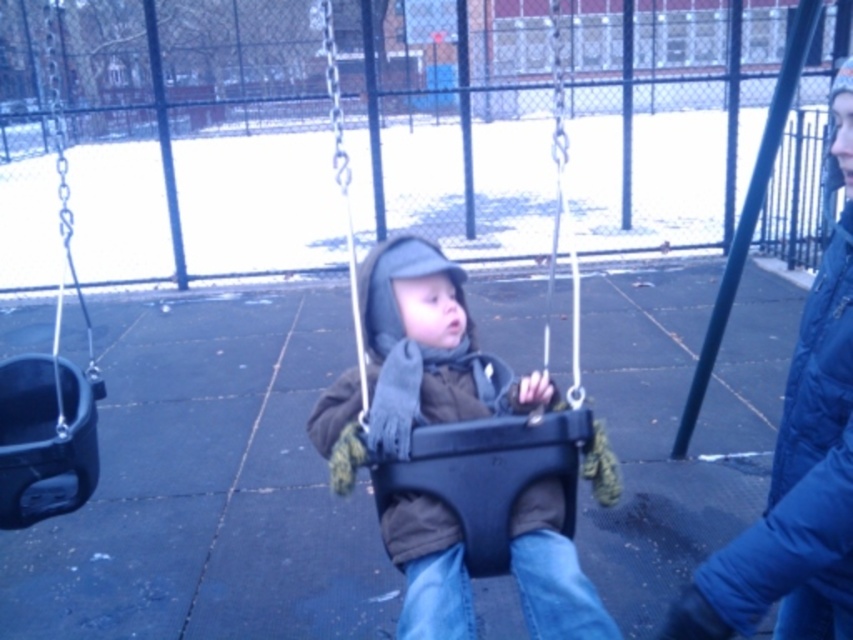
You are a parent trying to choose between two jackets for your child at the playground. You see the brown matte jacket at center and the blue fleece jacket at center. Which jacket is wider?

The brown matte jacket at center is wider than the blue fleece jacket at center according to the description.

You are standing at the point labeled point (491, 429) and want to walk to the point labeled point (404, 604). According to the image, which direction should you move relative to your current position?

You should move forward because point (404, 604) is in front of point (491, 429).

You are a parent at the playground and see the blue fleece jacket at center and the black plastic swing at left. Which object is positioned to the right of the other?

The blue fleece jacket at center is to the right of the black plastic swing at left.